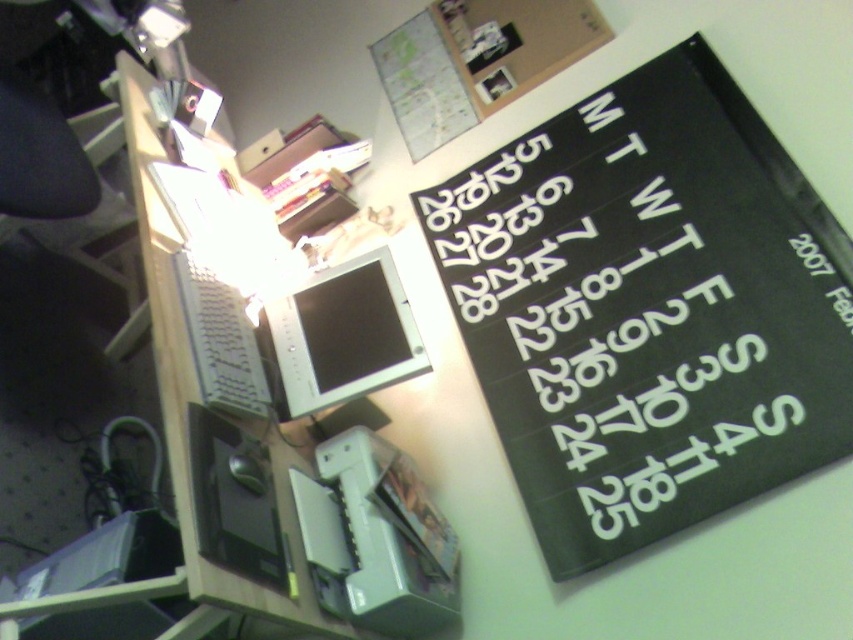
Question: Is the position of black paper calendar at upper right more distant than that of matte silver monitor at center?

Choices:
 (A) no
 (B) yes

Answer: (A)

Question: Does matte silver monitor at center come in front of satin silver keyboard at left?

Choices:
 (A) yes
 (B) no

Answer: (B)

Question: Considering the relative positions of black paper calendar at upper right and matte silver monitor at center in the image provided, where is black paper calendar at upper right located with respect to matte silver monitor at center?

Choices:
 (A) above
 (B) below

Answer: (A)

Question: Among these points, which one is farthest from the camera?

Choices:
 (A) (192, 236)
 (B) (567, 397)
 (C) (358, 330)
 (D) (262, 390)

Answer: (C)

Question: Which point is farther to the camera?

Choices:
 (A) black paper calendar at upper right
 (B) satin silver keyboard at left

Answer: (A)

Question: Estimate the real-world distances between objects in this image. Which object is closer to the white plastic computer desk at center?

Choices:
 (A) satin silver keyboard at left
 (B) black paper calendar at upper right

Answer: (A)